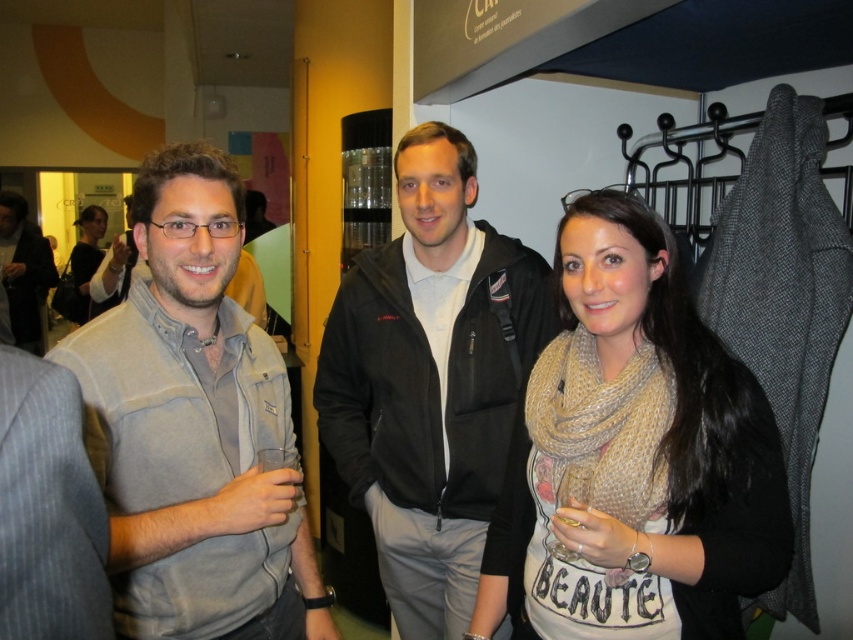
You are standing in the same room as the three individuals. You want to hand a document to the person wearing the gray fleece vest at left. Based on their position, where should you walk to find them?

The gray fleece vest at left is located at the 2D coordinates point (194, 428), so you should walk towards that position to find them.

You are organizing a photo shoot and need to know the relative widths of the black fleece jacket at center and the gray fleece jacket at left. Which one is wider?

The black fleece jacket at center is wider than the gray fleece jacket at left according to the description.